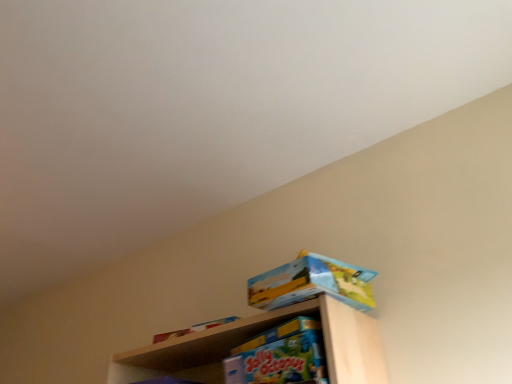
What do you see at coordinates (279, 355) in the screenshot? This screenshot has height=384, width=512. I see `matte blue board game at center, acting as the first toy starting from the bottom` at bounding box center [279, 355].

You are a GUI agent. You are given a task and a screenshot of the screen. Output one action in this format:
    pyautogui.click(x=<x>, y=<y>)
    Task: Click on the matte blue board game at center, acting as the first toy starting from the bottom
    This screenshot has width=512, height=384.
    Given the screenshot: What is the action you would take?
    pyautogui.click(x=279, y=355)

How much space does matte blue board game at center, which appears as the second toy when viewed from the top, occupy horizontally?

matte blue board game at center, which appears as the second toy when viewed from the top, is 9.11 inches in width.

The width and height of the screenshot is (512, 384). What do you see at coordinates (312, 283) in the screenshot?
I see `matte cardboard box at upper right, which ranks as the first toy in top-to-bottom order` at bounding box center [312, 283].

At what (x,y) coordinates should I click in order to perform the action: click on matte cardboard box at upper right, which ranks as the first toy in top-to-bottom order. Please return your answer as a coordinate pair (x, y). Looking at the image, I should click on (312, 283).

Find the location of a particular element. The width and height of the screenshot is (512, 384). matte blue board game at center, which appears as the second toy when viewed from the top is located at coordinates (279, 355).

Is matte blue board game at center, acting as the first toy starting from the bottom, to the left of matte cardboard box at upper right, which ranks as the first toy in top-to-bottom order, from the viewer's perspective?

Yes, matte blue board game at center, acting as the first toy starting from the bottom, is to the left of matte cardboard box at upper right, which ranks as the first toy in top-to-bottom order.

From the picture: Which object is further away from the camera, matte blue board game at center, acting as the first toy starting from the bottom, or matte cardboard box at upper right, which appears as the 2th toy when ordered from the bottom?

matte cardboard box at upper right, which appears as the 2th toy when ordered from the bottom, is behind.

Which is in front, point (314, 350) or point (350, 300)?

Positioned in front is point (314, 350).

From the image's perspective, is matte blue board game at center, which appears as the second toy when viewed from the top, on top of matte cardboard box at upper right, which ranks as the first toy in top-to-bottom order?

No, from the image's perspective, matte blue board game at center, which appears as the second toy when viewed from the top, is not over matte cardboard box at upper right, which ranks as the first toy in top-to-bottom order.

Consider the image. From a real-world perspective, who is located higher, matte blue board game at center, acting as the first toy starting from the bottom, or matte cardboard box at upper right, which appears as the 2th toy when ordered from the bottom?

matte cardboard box at upper right, which appears as the 2th toy when ordered from the bottom.

Considering the relative sizes of matte blue board game at center, acting as the first toy starting from the bottom, and matte cardboard box at upper right, which appears as the 2th toy when ordered from the bottom, in the image provided, is matte blue board game at center, acting as the first toy starting from the bottom, thinner than matte cardboard box at upper right, which appears as the 2th toy when ordered from the bottom,?

No.

Does matte blue board game at center, which appears as the second toy when viewed from the top, have a greater height compared to matte cardboard box at upper right, which appears as the 2th toy when ordered from the bottom?

Indeed, matte blue board game at center, which appears as the second toy when viewed from the top, has a greater height compared to matte cardboard box at upper right, which appears as the 2th toy when ordered from the bottom.

Considering the relative sizes of matte blue board game at center, which appears as the second toy when viewed from the top, and matte cardboard box at upper right, which ranks as the first toy in top-to-bottom order, in the image provided, is matte blue board game at center, which appears as the second toy when viewed from the top, bigger than matte cardboard box at upper right, which ranks as the first toy in top-to-bottom order,?

Yes, matte blue board game at center, which appears as the second toy when viewed from the top, is bigger than matte cardboard box at upper right, which ranks as the first toy in top-to-bottom order.

Is matte cardboard box at upper right, which appears as the 2th toy when ordered from the bottom, located within matte blue board game at center, which appears as the second toy when viewed from the top?

That's incorrect, matte cardboard box at upper right, which appears as the 2th toy when ordered from the bottom, is not inside matte blue board game at center, which appears as the second toy when viewed from the top.

In the scene shown: Does matte blue board game at center, acting as the first toy starting from the bottom, touch matte cardboard box at upper right, which ranks as the first toy in top-to-bottom order?

matte blue board game at center, acting as the first toy starting from the bottom, and matte cardboard box at upper right, which ranks as the first toy in top-to-bottom order, are clearly separated.

Consider the image. Is matte blue board game at center, which appears as the second toy when viewed from the top, oriented towards matte cardboard box at upper right, which ranks as the first toy in top-to-bottom order?

No, matte blue board game at center, which appears as the second toy when viewed from the top, is not turned towards matte cardboard box at upper right, which ranks as the first toy in top-to-bottom order.

What's the angular difference between matte blue board game at center, which appears as the second toy when viewed from the top, and matte cardboard box at upper right, which ranks as the first toy in top-to-bottom order,'s facing directions?

There is a 4.87-degree angle between the facing directions of matte blue board game at center, which appears as the second toy when viewed from the top, and matte cardboard box at upper right, which ranks as the first toy in top-to-bottom order.

Identify the location of toy that appears on the left of matte cardboard box at upper right, which ranks as the first toy in top-to-bottom order. This screenshot has height=384, width=512. (279, 355).

Which object is positioned more to the left, matte cardboard box at upper right, which appears as the 2th toy when ordered from the bottom, or matte blue board game at center, acting as the first toy starting from the bottom?

From the viewer's perspective, matte blue board game at center, acting as the first toy starting from the bottom, appears more on the left side.

Does matte cardboard box at upper right, which ranks as the first toy in top-to-bottom order, lie behind matte blue board game at center, which appears as the second toy when viewed from the top?

That is True.

Which is in front, point (369, 307) or point (252, 338)?

Point (369, 307)

From the image's perspective, relative to matte blue board game at center, acting as the first toy starting from the bottom, is matte cardboard box at upper right, which appears as the 2th toy when ordered from the bottom, above or below?

Based on their image positions, matte cardboard box at upper right, which appears as the 2th toy when ordered from the bottom, is located above matte blue board game at center, acting as the first toy starting from the bottom.

In the scene shown: From a real-world perspective, which object rests below the other?

From a 3D spatial view, matte blue board game at center, acting as the first toy starting from the bottom, is below.

Which of these two, matte cardboard box at upper right, which appears as the 2th toy when ordered from the bottom, or matte blue board game at center, which appears as the second toy when viewed from the top, is thinner?

matte cardboard box at upper right, which appears as the 2th toy when ordered from the bottom, is thinner.

Can you confirm if matte cardboard box at upper right, which ranks as the first toy in top-to-bottom order, is shorter than matte blue board game at center, acting as the first toy starting from the bottom?

Indeed, matte cardboard box at upper right, which ranks as the first toy in top-to-bottom order, has a lesser height compared to matte blue board game at center, acting as the first toy starting from the bottom.

Can you confirm if matte cardboard box at upper right, which appears as the 2th toy when ordered from the bottom, is smaller than matte blue board game at center, acting as the first toy starting from the bottom?

Indeed, matte cardboard box at upper right, which appears as the 2th toy when ordered from the bottom, has a smaller size compared to matte blue board game at center, acting as the first toy starting from the bottom.

Do you think matte cardboard box at upper right, which ranks as the first toy in top-to-bottom order, is within matte blue board game at center, acting as the first toy starting from the bottom, or outside of it?

matte cardboard box at upper right, which ranks as the first toy in top-to-bottom order, is outside matte blue board game at center, acting as the first toy starting from the bottom.

Would you say matte cardboard box at upper right, which appears as the 2th toy when ordered from the bottom, is a long distance from matte blue board game at center, acting as the first toy starting from the bottom?

No, matte cardboard box at upper right, which appears as the 2th toy when ordered from the bottom, is not far away from matte blue board game at center, acting as the first toy starting from the bottom.

Is matte cardboard box at upper right, which ranks as the first toy in top-to-bottom order, oriented towards matte blue board game at center, which appears as the second toy when viewed from the top?

No, matte cardboard box at upper right, which ranks as the first toy in top-to-bottom order, is not oriented towards matte blue board game at center, which appears as the second toy when viewed from the top.

In order to click on toy lying above the matte blue board game at center, acting as the first toy starting from the bottom (from the image's perspective) in this screenshot , I will do `click(312, 283)`.

Image resolution: width=512 pixels, height=384 pixels. What are the coordinates of `toy that appears behind the matte blue board game at center, acting as the first toy starting from the bottom` in the screenshot? It's located at (312, 283).

You are a GUI agent. You are given a task and a screenshot of the screen. Output one action in this format:
    pyautogui.click(x=<x>, y=<y>)
    Task: Click on the toy that appears below the matte cardboard box at upper right, which ranks as the first toy in top-to-bottom order (from a real-world perspective)
    
    Given the screenshot: What is the action you would take?
    pyautogui.click(x=279, y=355)